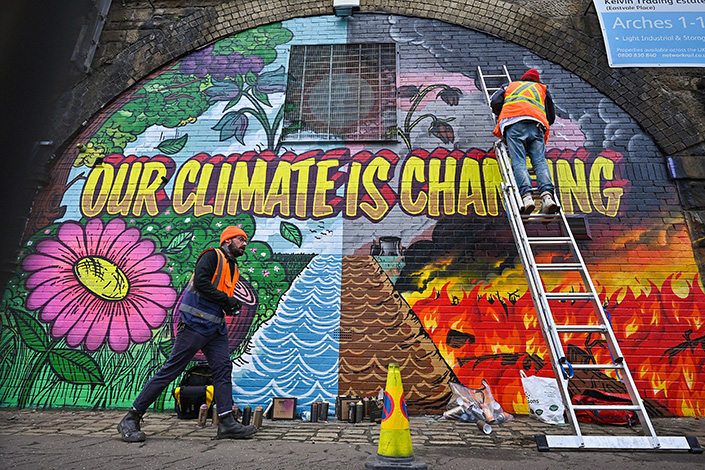
I want to click on mural, so click(355, 120).